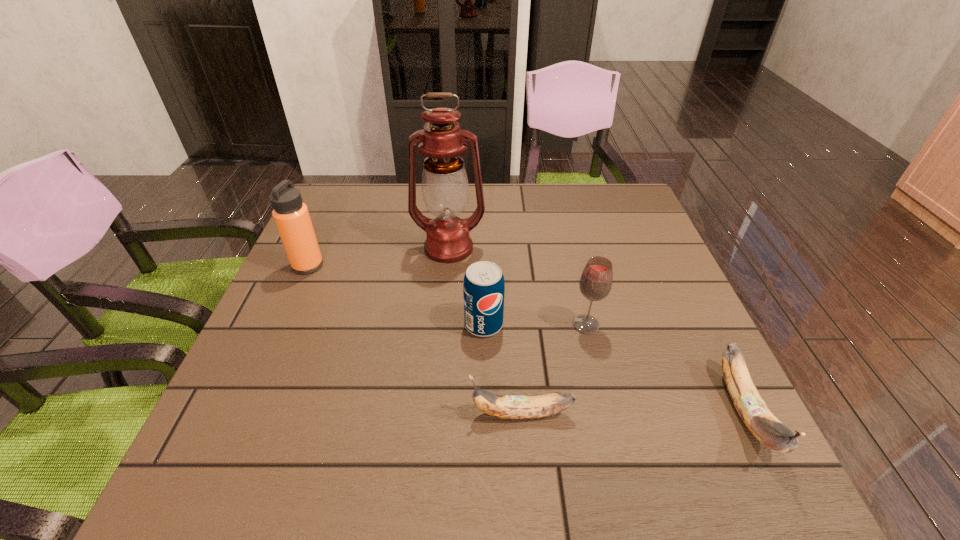
Find the location of `the shortest object`. the shortest object is located at coordinates (507, 407).

At what (x,y) coordinates should I click in order to perform the action: click on the left banana. Please return your answer as a coordinate pair (x, y). Looking at the image, I should click on (507, 407).

Find the location of a particular element. The image size is (960, 540). the second shortest object is located at coordinates (752, 409).

Where is `the right banana`? This screenshot has height=540, width=960. the right banana is located at coordinates (752, 409).

This screenshot has width=960, height=540. I want to click on the second object from right to left, so click(x=595, y=284).

Locate an element on the screen. The width and height of the screenshot is (960, 540). oil lamp is located at coordinates (445, 187).

Image resolution: width=960 pixels, height=540 pixels. What are the coordinates of `the leftmost object` in the screenshot? It's located at (291, 216).

You are a GUI agent. You are given a task and a screenshot of the screen. Output one action in this format:
    pyautogui.click(x=<x>, y=<y>)
    Task: Click on the fifth shortest object
    
    Given the screenshot: What is the action you would take?
    pyautogui.click(x=291, y=216)

You are a GUI agent. You are given a task and a screenshot of the screen. Output one action in this format:
    pyautogui.click(x=<x>, y=<y>)
    Task: Click on the pop
    
    Given the screenshot: What is the action you would take?
    pyautogui.click(x=483, y=288)

Locate an element on the screen. The height and width of the screenshot is (540, 960). free point located on the peel of the shortest object is located at coordinates (255, 414).